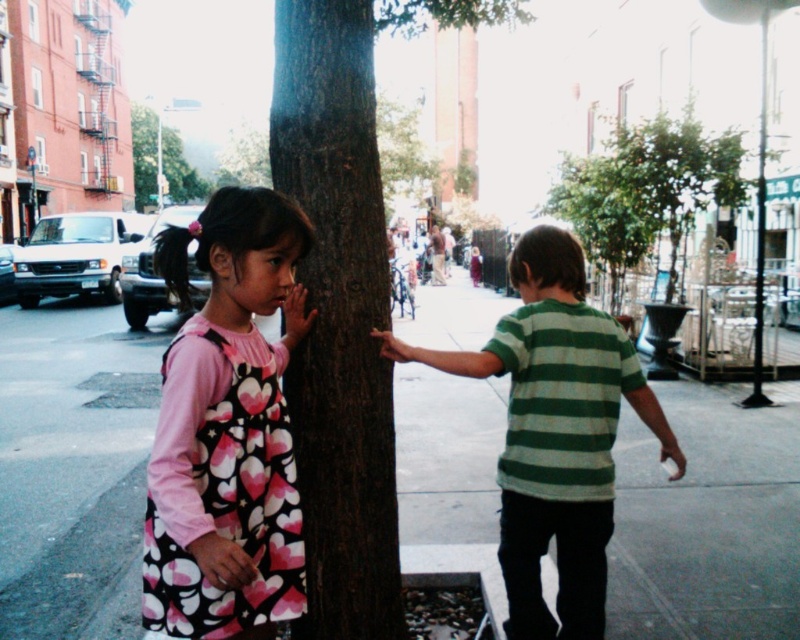
You are a delivery person trying to place a large package on the gray concrete sidewalk at center while avoiding the green textured tree at upper center. Can you fit the package on the sidewalk without it touching the tree?

The gray concrete sidewalk at center has a smaller size compared to green textured tree at upper center. Since the sidewalk is smaller, the package may not fit without overlapping the tree area. Check the exact dimensions before placing it.

You are a delivery robot trying to navigate through the sidewalk in the image. The sidewalk is 1.5 meters wide. You need to deliver a package to the boy on the right. Can you pass through the area where the brown rough tree trunk at center is located?

The brown rough tree trunk at center is located at point (338, 317), so the robot can pass through the area since the sidewalk is 1.5 meters wide and the tree trunk is positioned centrally, allowing enough space for navigation.